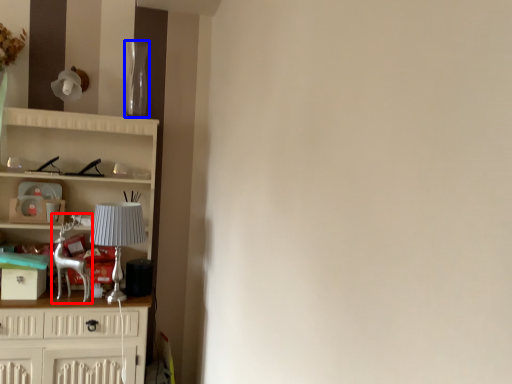
Question: Among these objects, which one is farthest to the camera, swivel chair (highlighted by a red box) or glass vase (highlighted by a blue box)?

Choices:
 (A) swivel chair
 (B) glass vase

Answer: (B)